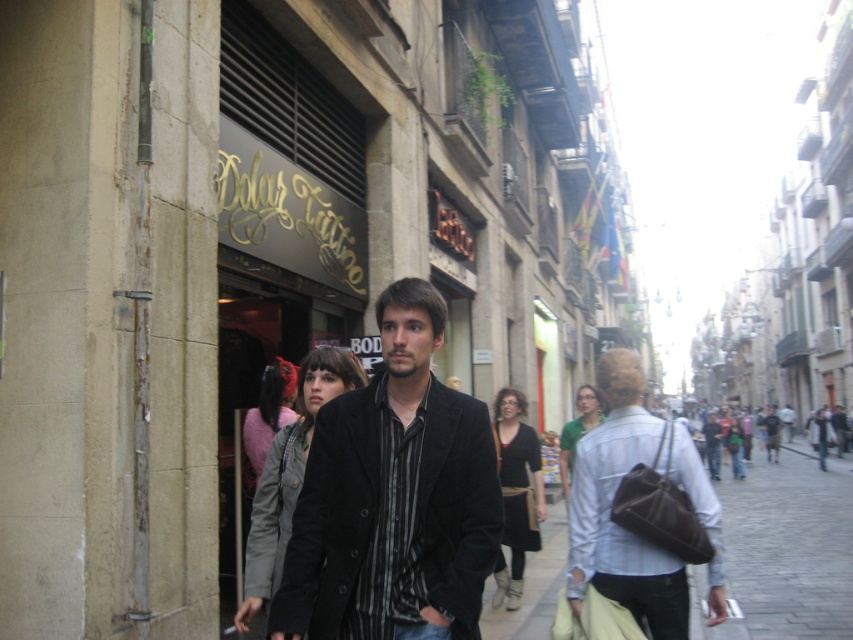
Question: Can you confirm if light blue denim shirt at center is bigger than gray matte jacket at center?

Choices:
 (A) yes
 (B) no

Answer: (B)

Question: Is black matte coat at center below gray matte jacket at center?

Choices:
 (A) yes
 (B) no

Answer: (B)

Question: Which point appears farthest from the camera in this image?

Choices:
 (A) (358, 458)
 (B) (845, 596)
 (C) (260, 529)
 (D) (663, 461)

Answer: (B)

Question: Estimate the real-world distances between objects in this image. Which object is farther from the gray matte jacket at center?

Choices:
 (A) brown leather bag at lower right
 (B) light blue denim shirt at center
 (C) black matte coat at center

Answer: (A)

Question: Does black matte coat at center appear on the right side of light blue denim shirt at center?

Choices:
 (A) yes
 (B) no

Answer: (B)

Question: Estimate the real-world distances between objects in this image. Which object is farther from the light blue denim shirt at center?

Choices:
 (A) brown leather bag at lower right
 (B) gray matte jacket at center

Answer: (A)